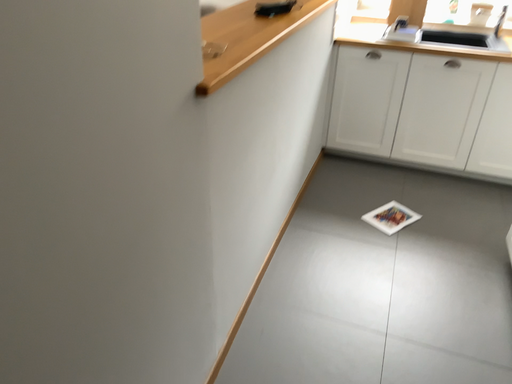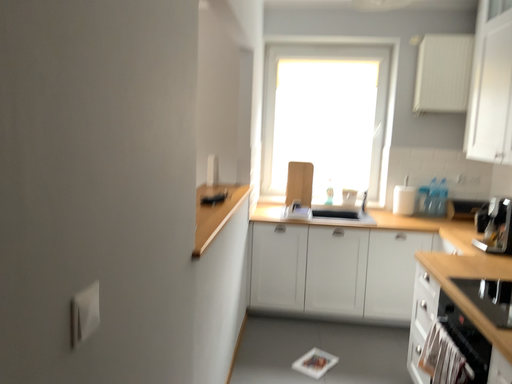
Question: How did the camera likely rotate when shooting the video?

Choices:
 (A) rotated upward
 (B) rotated downward

Answer: (A)